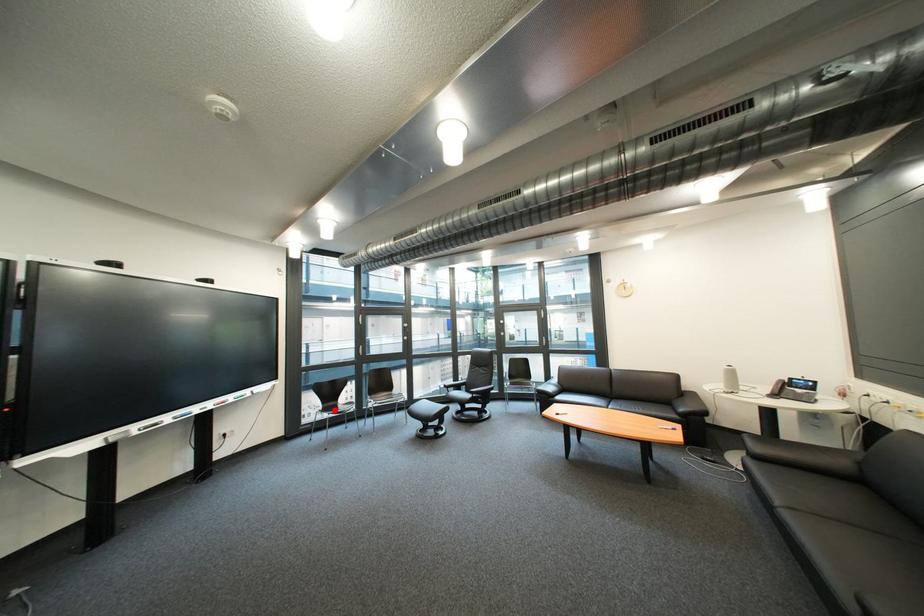
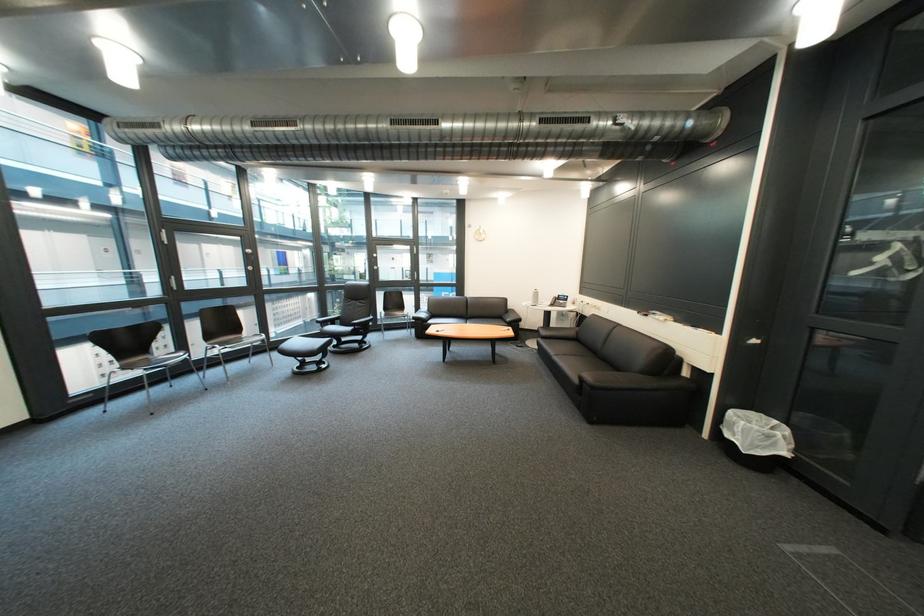
In the second image, find the point that corresponds to the highlighted location in the first image.

(131, 368)